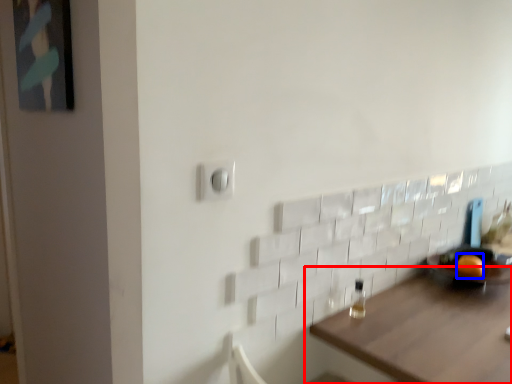
Question: Which object is closer to the camera taking this photo, table (highlighted by a red box) or orange (highlighted by a blue box)?

Choices:
 (A) table
 (B) orange

Answer: (A)